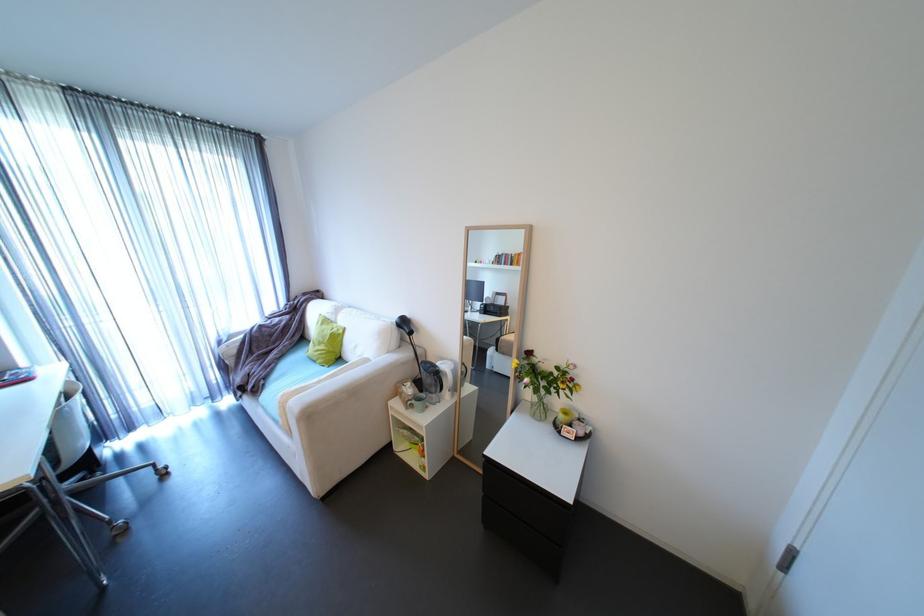
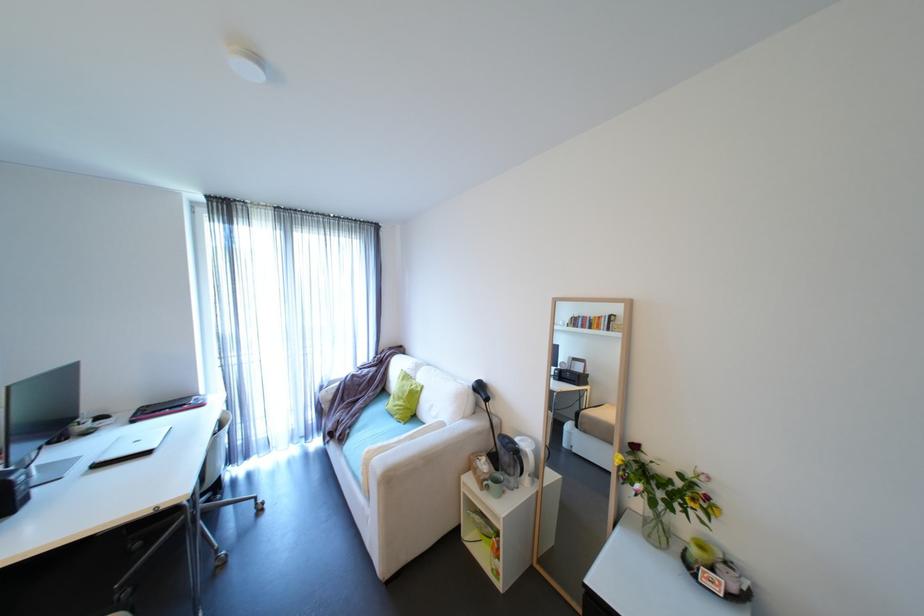
Find the pixel in the second image that matches the point at 233,339 in the first image.

(333, 386)